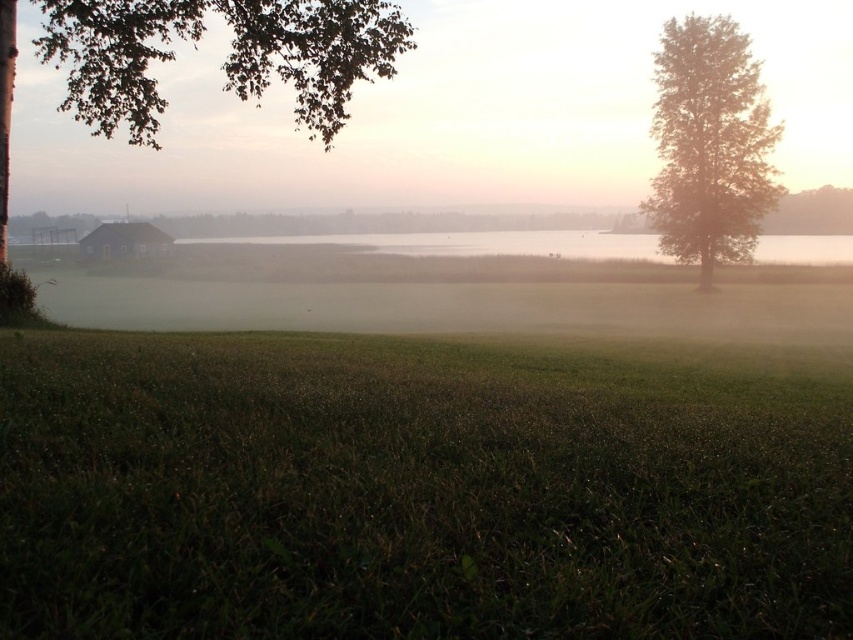
Between green grassy field at lower center and green leafy tree at right, which one appears on the left side from the viewer's perspective?

green grassy field at lower center

Locate an element on the screen. The width and height of the screenshot is (853, 640). green grassy field at lower center is located at coordinates (418, 490).

Identify the location of green grassy field at lower center. This screenshot has width=853, height=640. (418, 490).

Is point (271, 497) behind point (76, 45)?

No, it is not.

Is green grassy field at lower center shorter than green leafy tree at upper left?

Yes, green grassy field at lower center is shorter than green leafy tree at upper left.

What are the coordinates of `green grassy field at lower center` in the screenshot? It's located at (418, 490).

Between point (328, 58) and point (657, 52), which one is positioned in front?

Point (328, 58) is more forward.

In the scene shown: Can you confirm if green leafy tree at upper left is positioned above green leafy tree at right?

Yes.

Is point (189, 13) behind point (688, 250)?

No.

The width and height of the screenshot is (853, 640). Identify the location of green leafy tree at upper left. (225, 58).